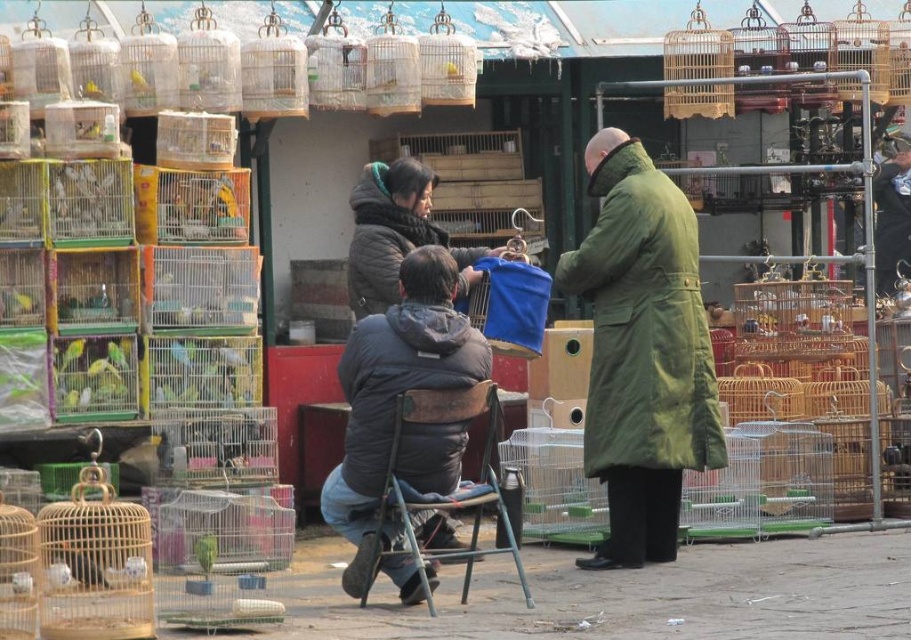
Based on the photo, you are a customer at the bird market and see both the green matte coat at center and the green matte birdcage at center. Which object is closer to you?

The green matte coat at center is closer to you because it is in front of the green matte birdcage at center.

Looking at this image, you are a customer at the bird market. You see the dark gray fleece jacket at center and the green matte birdcage at center. Which object is positioned to the right side?

The dark gray fleece jacket at center is positioned to the right of the green matte birdcage at center.

You are a customer at the bird market and want to buy a bird from the vendor. You are standing next to the dark brown fur coat at center. The vendor is near the yellow matte birdcage at upper left. Can you easily walk over to the vendor without needing to move any obstacles?

The dark brown fur coat at center is 4.16 meters away from the yellow matte birdcage at upper left. Since the distance is over 4 meters, it might require walking a bit, but there are no mentioned obstacles in the scene description, so you can easily walk over to the vendor.